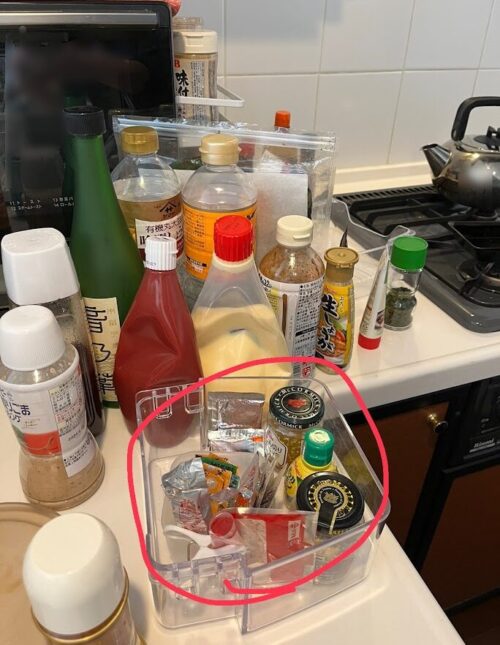
At what (x,y) coordinates should I click in order to perform the action: click on plastic bin. Please return your answer as a coordinate pair (x, y). Image resolution: width=500 pixels, height=645 pixels. Looking at the image, I should click on (179, 424).